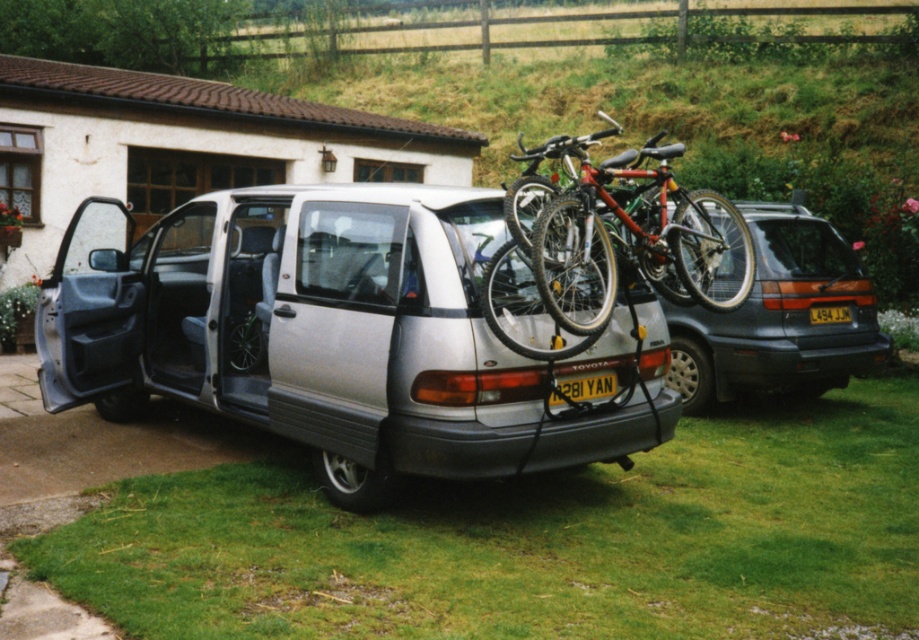
You are standing in front of the silver Toyota vehicle and want to place a small potted plant between the two points marked as point (x=174, y=328) and point (x=576, y=390). Which point should the plant be closer to in order to be closer to the viewer?

The plant should be closer to point (x=174, y=328) because it is closer to the viewer compared to point (x=576, y=390).

You are a delivery person trying to load a package onto the roof of the silver Toyota. The package is 1.2 meters tall. Can the package fit vertically between the shiny metallic bicycle at rear and the yellow plastic license plate at rear?

The shiny metallic bicycle at rear is much taller than the yellow plastic license plate at rear. Since the bicycle is taller, the vertical space between them may not be sufficient for the 1.2 meter tall package. The package might not fit vertically between the shiny metallic bicycle at rear and the yellow plastic license plate at rear.

You are standing at the origin point of the image coordinate system. The origin is at the bottom left corner of the image. You want to walk towards the matte silver minivan at center. In which direction should you move first?

Since the matte silver minivan at center is located at point (x=779, y=317) in the 2D coordinate system, you should move upward first because the y coordinate is 0.849, which is closer to the top of the image. However, since the x coordinate is near the center, you might also need to move slightly to the right or left depending on your current position. But since you are at the origin, which is the bottom left corner, moving upward is the first step to reach the matte silver minivan at center.